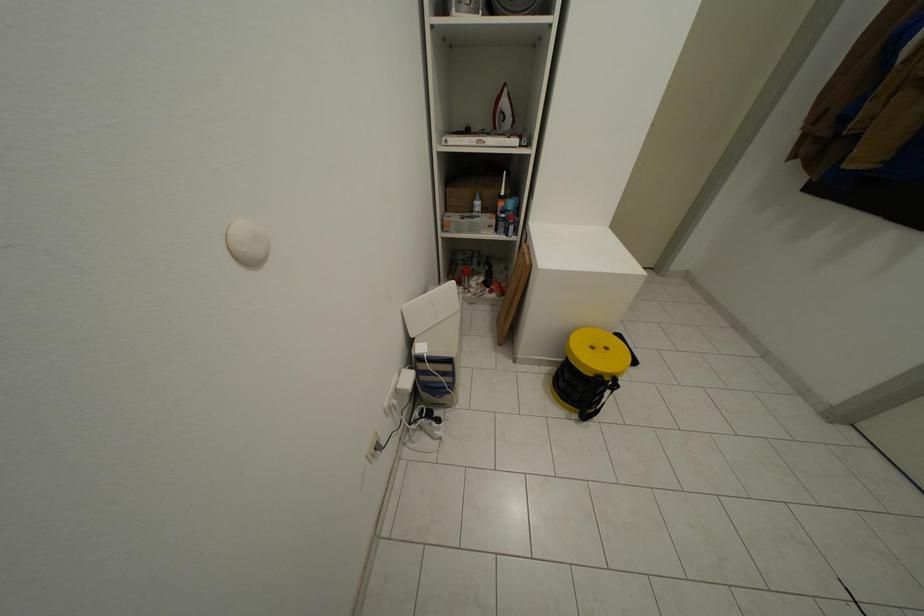
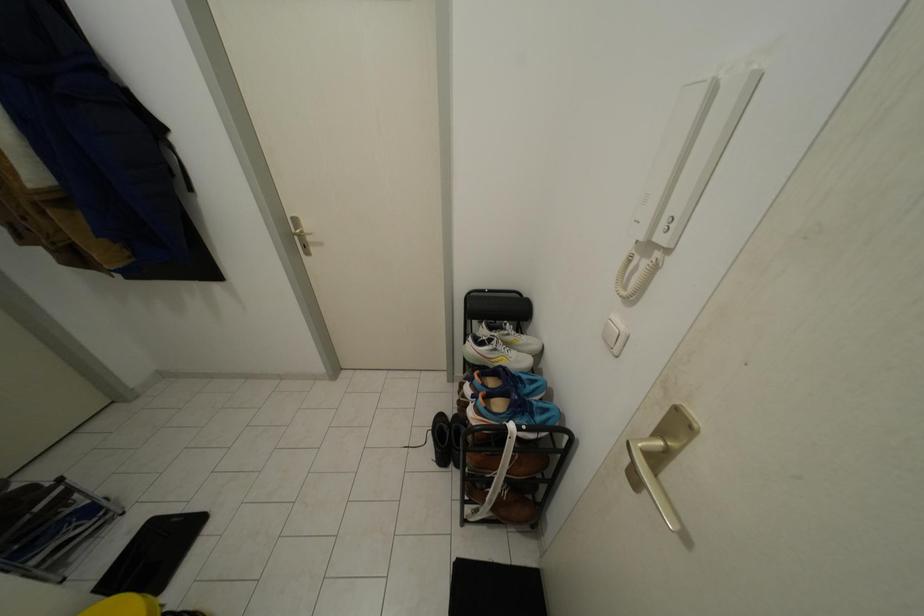
The first image is from the beginning of the video and the second image is from the end. How did the camera likely rotate when shooting the video?

The camera rotated toward right-down.